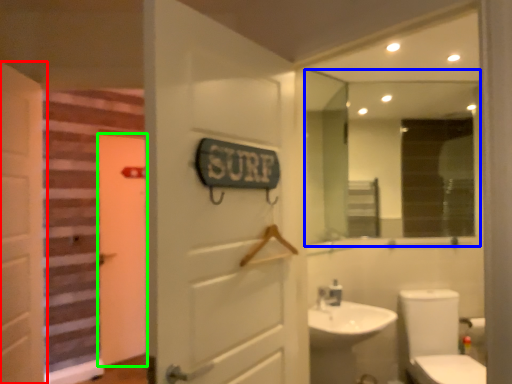
Question: Which object is positioned closest to door (highlighted by a red box)? Select from mirror (highlighted by a blue box) and door (highlighted by a green box).

Choices:
 (A) mirror
 (B) door

Answer: (B)